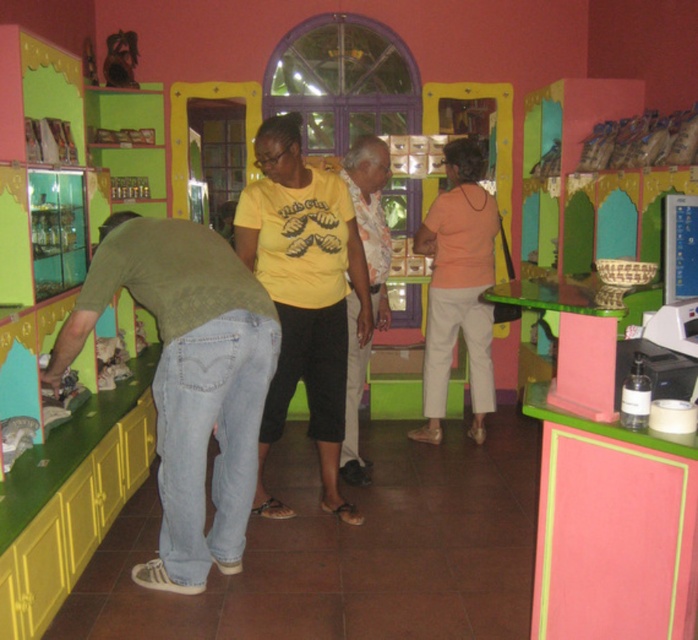
Question: Is denim jeans at lower left closer to camera compared to matte peach blouse at center?

Choices:
 (A) yes
 (B) no

Answer: (A)

Question: Which of these objects is positioned closest to the matte peach blouse at center?

Choices:
 (A) white fabric shirt at center
 (B) yellow matte t-shirt at center
 (C) denim jeans at lower left

Answer: (A)

Question: Is denim jeans at lower left positioned in front of white fabric shirt at center?

Choices:
 (A) yes
 (B) no

Answer: (A)

Question: Which object is closer to the camera taking this photo?

Choices:
 (A) white fabric shirt at center
 (B) yellow matte t-shirt at center
 (C) matte peach blouse at center

Answer: (B)

Question: Which point appears closest to the camera in this image?

Choices:
 (A) (386, 168)
 (B) (438, 424)
 (C) (195, 413)

Answer: (C)

Question: Considering the relative positions of yellow matte t-shirt at center and matte peach blouse at center in the image provided, where is yellow matte t-shirt at center located with respect to matte peach blouse at center?

Choices:
 (A) below
 (B) above

Answer: (A)